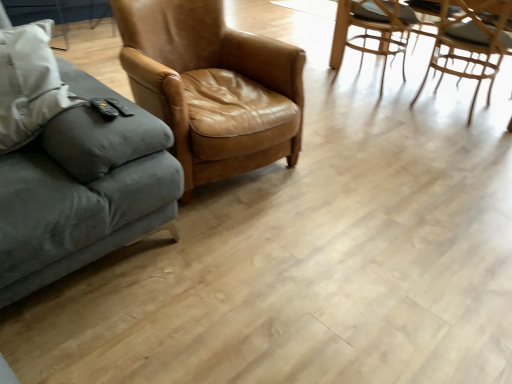
Identify the location of free location in front of brown leather chair at center, the 3th chair in the right-to-left sequence. Image resolution: width=512 pixels, height=384 pixels. (268, 268).